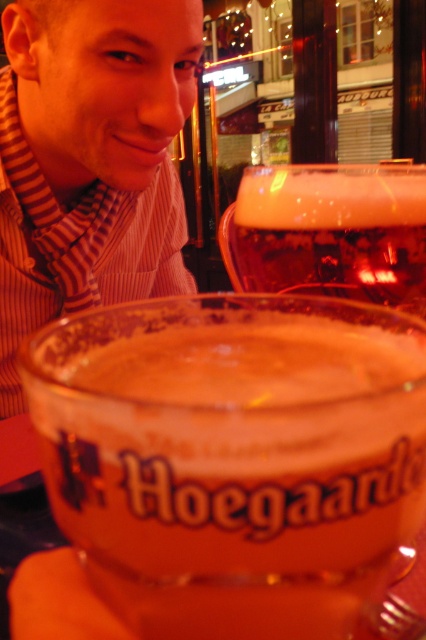
You are a bartender trying to place the translucent glass Hoegaarden beer at center on a shelf. The shelf has a coordinate system where the bottom left corner is the origin. The shelf is 1.2 meters wide and 0.8 meters tall. Can the beer glass be placed at its current position without exceeding the shelf boundaries?

The translucent glass Hoegaarden beer at center is located at point (233,458). Assuming the coordinates are normalized between 0 and 1, the position corresponds to 0.716 meters in width and 0.547 meters in height. The shelf is 1.2 meters wide and 0.8 meters tall. Since 0.716 meters is less than 1.2 meters and 0.547 meters is less than 0.8 meters, the beer glass can be placed at its current position without exceeding the shelf boundaries.

You are a photographer standing in front of the scene. You want to take a closeup of the matte striped scarf at upper left without moving your position. Can you focus on it clearly?

The matte striped scarf at upper left is 18.09 inches from viewer, so yes, the photographer can focus on it clearly since it is within a reasonable distance for a closeup shot.